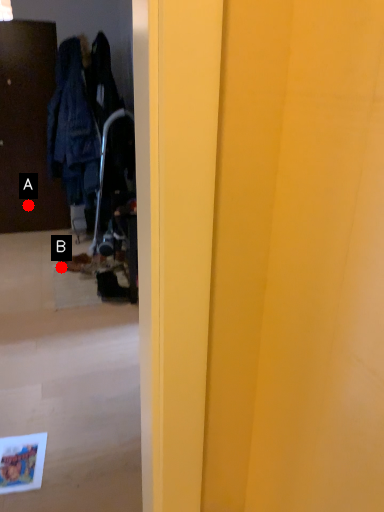
Question: Two points are circled on the image, labeled by A and B beside each circle. Which point appears farthest from the camera in this image?

Choices:
 (A) A is further
 (B) B is further

Answer: (A)